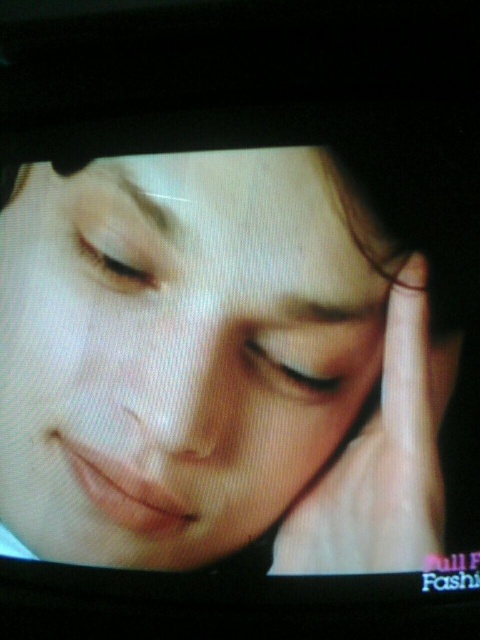
Which is above, smooth skin finger at center or matte white eye at center?

matte white eye at center

Can you confirm if smooth skin finger at center is positioned to the right of matte white eye at center?

Correct, you'll find smooth skin finger at center to the right of matte white eye at center.

Between point (343, 532) and point (323, 387), which one is positioned behind?

Point (323, 387)

You are a GUI agent. You are given a task and a screenshot of the screen. Output one action in this format:
    pyautogui.click(x=<x>, y=<y>)
    Task: Click on the smooth skin finger at center
    The image size is (480, 640).
    Given the screenshot: What is the action you would take?
    pyautogui.click(x=383, y=460)

Looking at this image, who is shorter, matte skin eye at center or matte white eye at center?

Answer: matte white eye at center is shorter.

Does matte skin eye at center have a greater height compared to matte white eye at center?

Yes.

Is point (91, 241) in front of point (286, 394)?

No, (91, 241) is further to viewer.

Image resolution: width=480 pixels, height=640 pixels. Identify the location of matte skin eye at center. (122, 259).

Is smooth skin face at center thinner than matte white eye at center?

Incorrect, smooth skin face at center's width is not less than matte white eye at center's.

The height and width of the screenshot is (640, 480). Identify the location of smooth skin face at center. (179, 349).

Image resolution: width=480 pixels, height=640 pixels. What are the coordinates of `smooth skin face at center` in the screenshot? It's located at (179, 349).